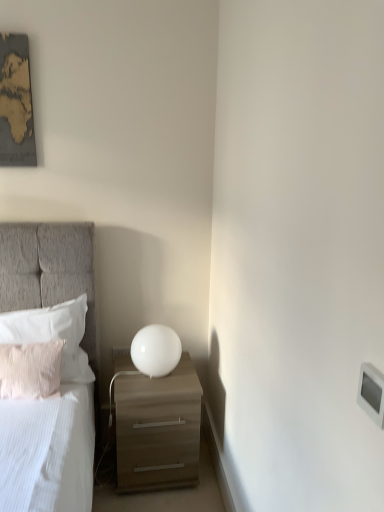
Question: Could you tell me if matte wood drawer at lower left is turned towards beige textured pillow at left, which is the first pillow from front to back?

Choices:
 (A) no
 (B) yes

Answer: (A)

Question: Is matte wood drawer at lower left to the right of beige textured pillow at left, the second pillow from the back, from the viewer's perspective?

Choices:
 (A) no
 (B) yes

Answer: (B)

Question: Is matte wood drawer at lower left far away from beige textured pillow at left, which is the first pillow from front to back?

Choices:
 (A) yes
 (B) no

Answer: (B)

Question: Is matte wood drawer at lower left at the left side of beige textured pillow at left, which is the first pillow from front to back?

Choices:
 (A) yes
 (B) no

Answer: (B)

Question: Is the position of matte wood drawer at lower left more distant than that of beige textured pillow at left, the second pillow from the back?

Choices:
 (A) no
 (B) yes

Answer: (B)

Question: Does matte wood drawer at lower left have a greater width compared to beige textured pillow at left, which is the first pillow from front to back?

Choices:
 (A) no
 (B) yes

Answer: (B)

Question: Is the depth of white plastic electric outlet at lower right greater than that of white plastic light switch at upper right?

Choices:
 (A) yes
 (B) no

Answer: (A)

Question: Is white plastic electric outlet at lower right with white plastic light switch at upper right?

Choices:
 (A) yes
 (B) no

Answer: (B)

Question: Is white plastic electric outlet at lower right in front of white plastic light switch at upper right?

Choices:
 (A) no
 (B) yes

Answer: (A)

Question: Is white plastic electric outlet at lower right aimed at white plastic light switch at upper right?

Choices:
 (A) yes
 (B) no

Answer: (B)

Question: From a real-world perspective, is white plastic electric outlet at lower right positioned under white plastic light switch at upper right based on gravity?

Choices:
 (A) yes
 (B) no

Answer: (A)

Question: Does white plastic electric outlet at lower right have a greater height compared to white plastic light switch at upper right?

Choices:
 (A) no
 (B) yes

Answer: (B)

Question: Is the position of white plastic electric outlet at lower right less distant than that of white soft pillow at left, the 2th pillow from the front?

Choices:
 (A) yes
 (B) no

Answer: (B)